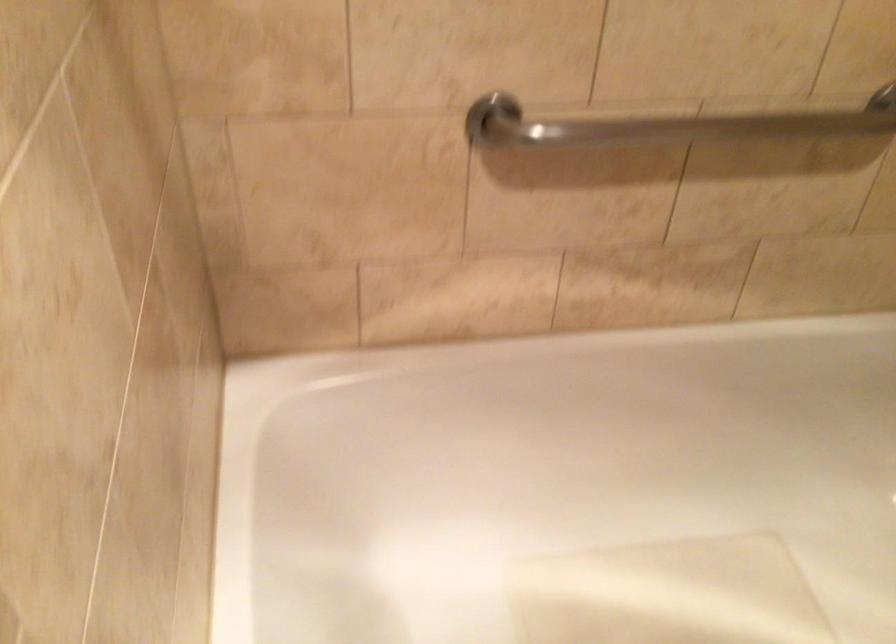
Where would you grasp the shower grab bar? Please return your answer as a coordinate pair (x, y).

(668, 124)